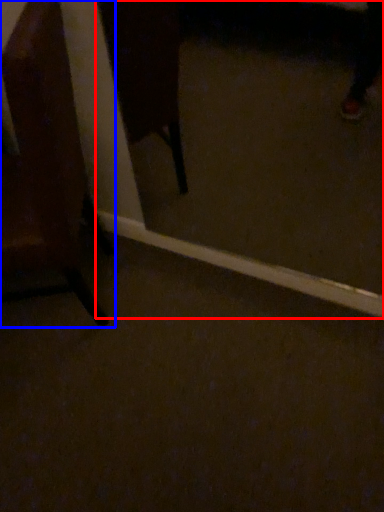
Question: Which point is closer to the camera, glass door (highlighted by a red box) or chair (highlighted by a blue box)?

Choices:
 (A) glass door
 (B) chair

Answer: (B)